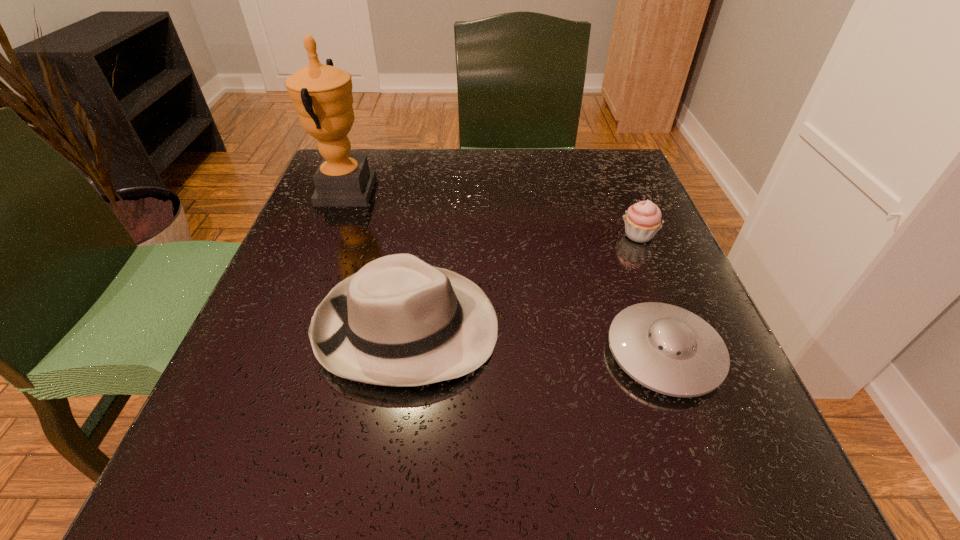
At what (x,y) coordinates should I click in order to perform the action: click on object at the far edge. Please return your answer as a coordinate pair (x, y). Looking at the image, I should click on (322, 95).

Identify the location of award located at the left edge. (322, 95).

The image size is (960, 540). In order to click on fedora present at the left edge in this screenshot , I will do `click(398, 321)`.

This screenshot has height=540, width=960. I want to click on cupcake that is at the right edge, so click(x=642, y=220).

This screenshot has height=540, width=960. What are the coordinates of `saucer positioned at the right edge` in the screenshot? It's located at (668, 349).

You are a GUI agent. You are given a task and a screenshot of the screen. Output one action in this format:
    pyautogui.click(x=<x>, y=<y>)
    Task: Click on the object at the far left corner
    The width and height of the screenshot is (960, 540).
    Given the screenshot: What is the action you would take?
    pyautogui.click(x=322, y=95)

Where is `vacant area at the far edge of the desktop`? The image size is (960, 540). vacant area at the far edge of the desktop is located at coordinates [x=558, y=158].

The height and width of the screenshot is (540, 960). In the image, there is a desktop. What are the coordinates of `vacant space at the left edge` in the screenshot? It's located at (323, 246).

In the image, there is a desktop. What are the coordinates of `free space at the right edge` in the screenshot? It's located at (607, 217).

Image resolution: width=960 pixels, height=540 pixels. Find the location of `vacant area at the far left corner`. vacant area at the far left corner is located at coordinates pyautogui.click(x=386, y=191).